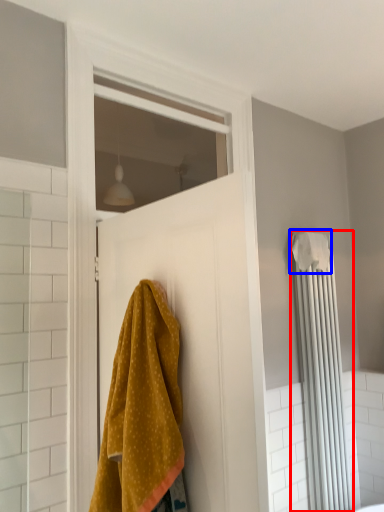
Question: Which object appears closest to the camera in this image, shower curtain (highlighted by a red box) or bath towel (highlighted by a blue box)?

Choices:
 (A) shower curtain
 (B) bath towel

Answer: (A)